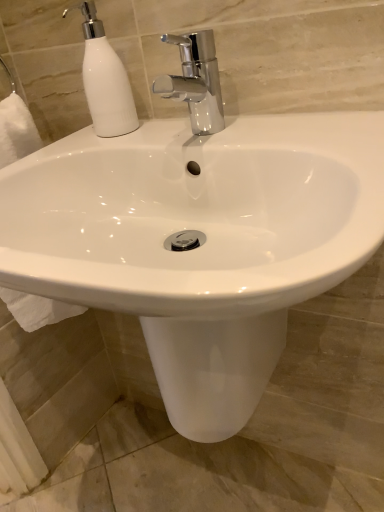
Where is `white matte soap dispenser at upper left`? The image size is (384, 512). white matte soap dispenser at upper left is located at coordinates (105, 79).

What is the approximate width of white matte soap dispenser at upper left?

white matte soap dispenser at upper left is 3.60 inches in width.

What do you see at coordinates (105, 79) in the screenshot?
I see `white matte soap dispenser at upper left` at bounding box center [105, 79].

In order to face chrome metallic faucet at upper center, should I rotate leftwards or rightwards?

A 0.477 degree turn to the left will do.

The image size is (384, 512). I want to click on chrome metallic faucet at upper center, so click(195, 81).

Describe the element at coordinates (195, 81) in the screenshot. This screenshot has width=384, height=512. I see `chrome metallic faucet at upper center` at that location.

Image resolution: width=384 pixels, height=512 pixels. I want to click on white matte soap dispenser at upper left, so click(105, 79).

Based on the photo, in the image, is white matte soap dispenser at upper left on the left side or the right side of chrome metallic faucet at upper center?

From the image, it's evident that white matte soap dispenser at upper left is to the left of chrome metallic faucet at upper center.

Which object is further away from the camera taking this photo, white matte soap dispenser at upper left or chrome metallic faucet at upper center?

white matte soap dispenser at upper left.

Considering the positions of points (105, 62) and (206, 42), is point (105, 62) closer to camera compared to point (206, 42)?

No, it is not.

Based on the photo, from the image's perspective, is white matte soap dispenser at upper left located above or below chrome metallic faucet at upper center?

white matte soap dispenser at upper left is above chrome metallic faucet at upper center.

From a real-world perspective, is white matte soap dispenser at upper left on top of chrome metallic faucet at upper center?

Indeed, from a real-world perspective, white matte soap dispenser at upper left stands above chrome metallic faucet at upper center.

In terms of width, does white matte soap dispenser at upper left look wider or thinner when compared to chrome metallic faucet at upper center?

Considering their sizes, white matte soap dispenser at upper left looks slimmer than chrome metallic faucet at upper center.

Between white matte soap dispenser at upper left and chrome metallic faucet at upper center, which one has less height?

Standing shorter between the two is chrome metallic faucet at upper center.

Who is bigger, white matte soap dispenser at upper left or chrome metallic faucet at upper center?

chrome metallic faucet at upper center is bigger.

Which is correct: white matte soap dispenser at upper left is inside chrome metallic faucet at upper center, or outside of it?

white matte soap dispenser at upper left cannot be found inside chrome metallic faucet at upper center.

Would you consider white matte soap dispenser at upper left to be distant from chrome metallic faucet at upper center?

Actually, white matte soap dispenser at upper left and chrome metallic faucet at upper center are a little close together.

Is white matte soap dispenser at upper left facing away from chrome metallic faucet at upper center?

No.

How different are the orientations of white matte soap dispenser at upper left and chrome metallic faucet at upper center in degrees?

The angular difference between white matte soap dispenser at upper left and chrome metallic faucet at upper center is 0.00256 degrees.

Find the location of a particular element. Image resolution: width=384 pixels, height=512 pixels. tap in front of the white matte soap dispenser at upper left is located at coordinates (195, 81).

Is chrome metallic faucet at upper center to the left of white matte soap dispenser at upper left from the viewer's perspective?

No.

Relative to white matte soap dispenser at upper left, is chrome metallic faucet at upper center in front or behind?

Clearly, chrome metallic faucet at upper center is in front of white matte soap dispenser at upper left.

Is point (167, 89) closer or farther from the camera than point (126, 116)?

Point (167, 89) appears to be closer to the viewer than point (126, 116).

From the image's perspective, is chrome metallic faucet at upper center located above or below white matte soap dispenser at upper left?

Based on their image positions, chrome metallic faucet at upper center is located beneath white matte soap dispenser at upper left.

From a real-world perspective, is chrome metallic faucet at upper center positioned above or below white matte soap dispenser at upper left?

From a real-world perspective, chrome metallic faucet at upper center is physically below white matte soap dispenser at upper left.

Which object is thinner, chrome metallic faucet at upper center or white matte soap dispenser at upper left?

Thinner between the two is white matte soap dispenser at upper left.

Does chrome metallic faucet at upper center have a greater height compared to white matte soap dispenser at upper left?

No, chrome metallic faucet at upper center is not taller than white matte soap dispenser at upper left.

Considering the sizes of objects chrome metallic faucet at upper center and white matte soap dispenser at upper left in the image provided, who is smaller, chrome metallic faucet at upper center or white matte soap dispenser at upper left?

Smaller between the two is white matte soap dispenser at upper left.

Is white matte soap dispenser at upper left inside chrome metallic faucet at upper center?

Definitely not — white matte soap dispenser at upper left is not inside chrome metallic faucet at upper center.

Is there a large distance between chrome metallic faucet at upper center and white matte soap dispenser at upper left?

chrome metallic faucet at upper center is actually quite close to white matte soap dispenser at upper left.

Does chrome metallic faucet at upper center turn towards white matte soap dispenser at upper left?

No, chrome metallic faucet at upper center does not turn towards white matte soap dispenser at upper left.

Could you measure the distance between chrome metallic faucet at upper center and white matte soap dispenser at upper left?

chrome metallic faucet at upper center and white matte soap dispenser at upper left are 4.54 inches apart from each other.

The width and height of the screenshot is (384, 512). In order to click on soap dispenser on the left of chrome metallic faucet at upper center in this screenshot , I will do `click(105, 79)`.

In the image, there is a chrome metallic faucet at upper center. Identify the location of soap dispenser above it (from the image's perspective). [105, 79].

What are the coordinates of `tap in front of the white matte soap dispenser at upper left` in the screenshot? It's located at (195, 81).